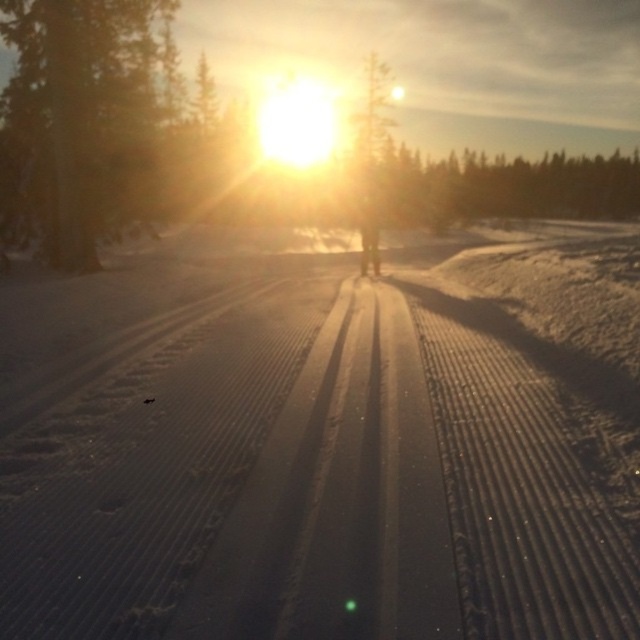
Who is more forward, (24, 125) or (392, 168)?

Positioned in front is point (24, 125).

Is point (211, 140) less distant than point (396, 182)?

Yes, it is.

The image size is (640, 640). What do you see at coordinates (97, 122) in the screenshot?
I see `green textured tree at upper left` at bounding box center [97, 122].

This screenshot has height=640, width=640. Find the location of `green textured tree at upper left`. green textured tree at upper left is located at coordinates (97, 122).

Is point (67, 611) positioned in front of point (13, 221)?

Yes.

Does white textured snow at center appear over green textured tree at upper left?

Actually, white textured snow at center is below green textured tree at upper left.

Who is more distant from viewer, (161,596) or (128,152)?

Point (128,152)

You are a GUI agent. You are given a task and a screenshot of the screen. Output one action in this format:
    pyautogui.click(x=<x>, y=<y>)
    Task: Click on the white textured snow at center
    
    Given the screenshot: What is the action you would take?
    pyautogui.click(x=323, y=444)

Who is taller, green matte tree at upper center or green textured tree at center?

green textured tree at center is taller.

Which is behind, point (508, 176) or point (384, 132)?

The point (508, 176) is more distant.

Who is more distant from viewer, [388,164] or [364,116]?

Point [364,116]

Identify the location of green matte tree at upper center. Image resolution: width=640 pixels, height=640 pixels. (508, 188).